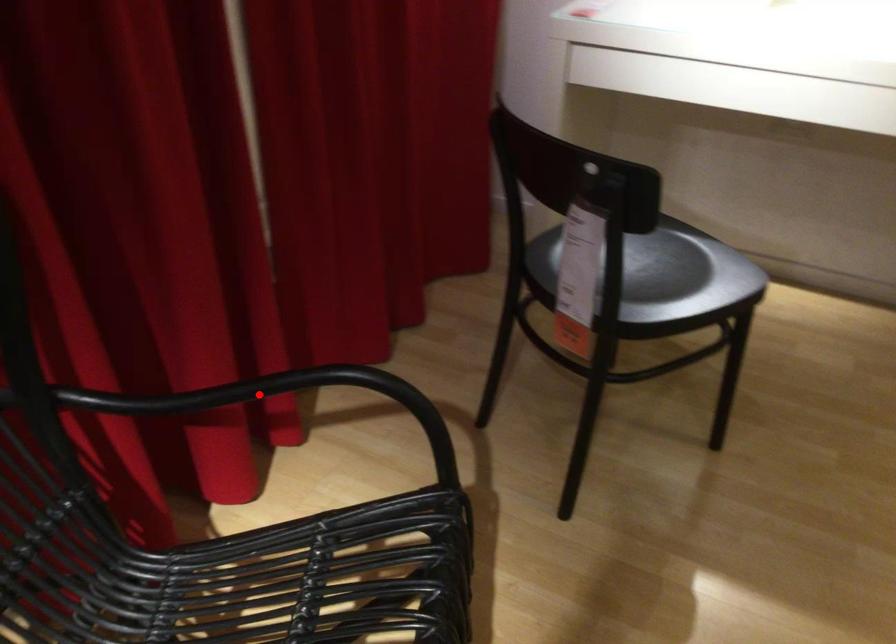
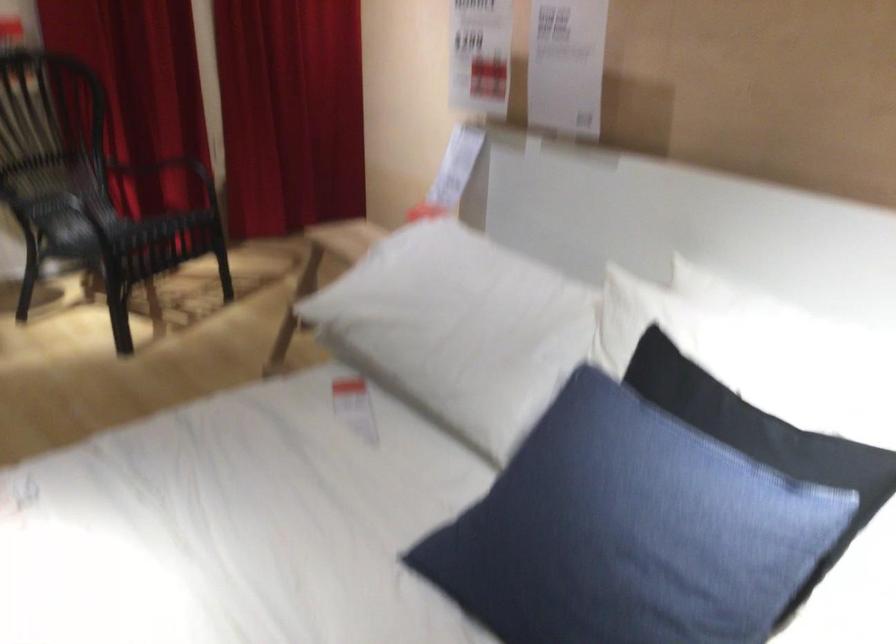
Question: I am providing you with two images of the same scene from different viewpoints. A red point is marked on the first image. Is the red point's position out of view in image 2?

Choices:
 (A) Yes
 (B) No

Answer: (A)